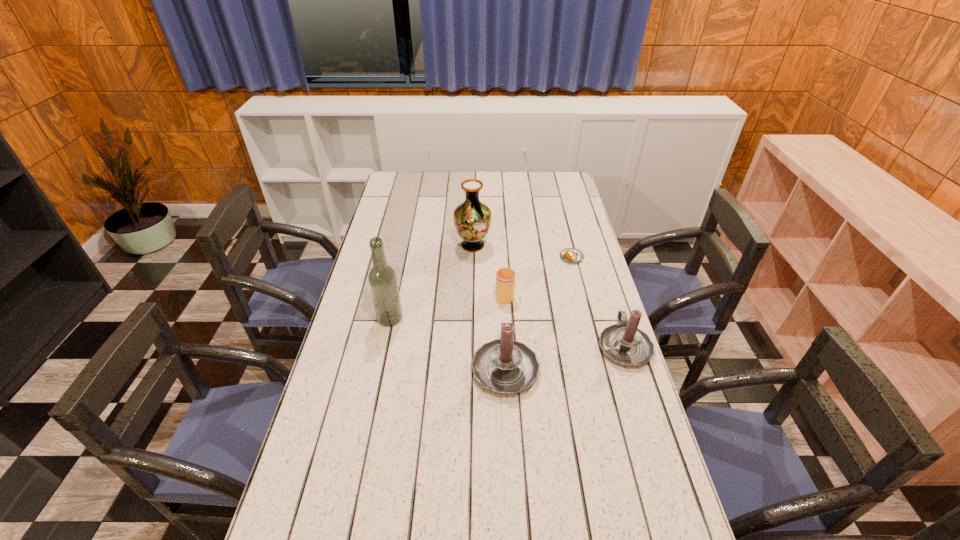
You are a GUI agent. You are given a task and a screenshot of the screen. Output one action in this format:
    pyautogui.click(x=<x>, y=<y>)
    Task: Click on the vacant space located 0.150m on the right of the liquor
    This screenshot has width=960, height=540.
    Given the screenshot: What is the action you would take?
    pyautogui.click(x=448, y=319)

Identify the location of object at the left edge. The height and width of the screenshot is (540, 960). (382, 278).

Identify the location of candle that is at the right edge. (624, 343).

Locate an element on the screen. The width and height of the screenshot is (960, 540). pastry present at the right edge is located at coordinates (571, 255).

What are the coordinates of `free region at the far edge of the desktop` in the screenshot? It's located at (438, 196).

The image size is (960, 540). What are the coordinates of `vacant region at the left edge` in the screenshot? It's located at (337, 384).

Identify the location of vacant space at the right edge of the desktop. (649, 491).

Identify the location of vacant area at the far left corner of the desktop. The image size is (960, 540). (394, 185).

The width and height of the screenshot is (960, 540). I want to click on vacant area that lies between the shorter candle and the fourth shortest object, so click(x=564, y=356).

Locate an element on the screen. vacant point located between the fifth shortest object and the fourth shortest object is located at coordinates (489, 306).